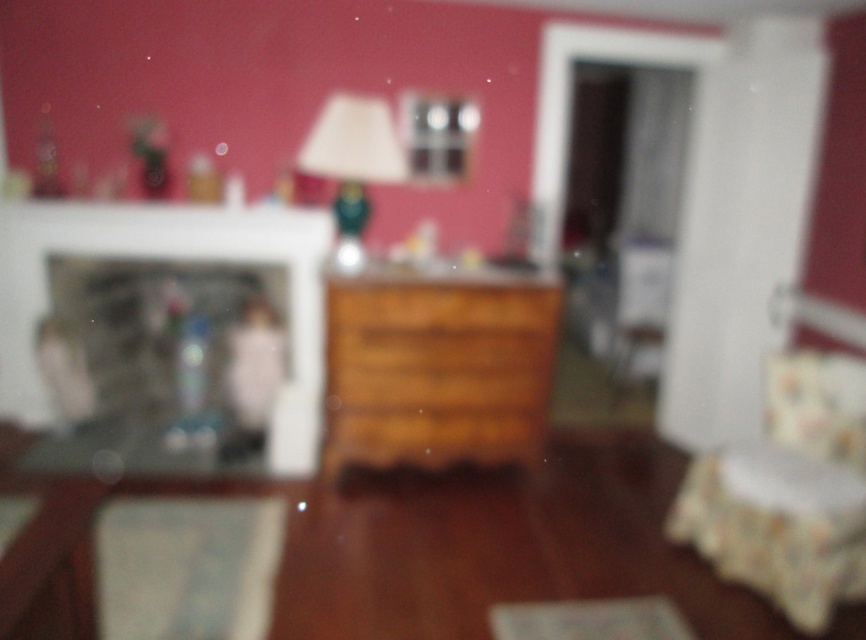
Is white glossy fireplace at center to the right of wooden drawer at center from the viewer's perspective?

Incorrect, white glossy fireplace at center is not on the right side of wooden drawer at center.

In the scene shown: Which is more to the right, white glossy fireplace at center or wooden drawer at center?

wooden drawer at center

Looking at this image, measure the distance between point (307, 252) and camera.

Point (307, 252) and camera are 3.62 meters apart.

At what (x,y) coordinates should I click in order to perform the action: click on white glossy fireplace at center. Please return your answer as a coordinate pair (x, y). Looking at the image, I should click on (167, 259).

Can you confirm if white glossy fireplace at center is positioned below matte green lamp at center?

Yes.

Which is in front, point (282, 465) or point (376, 164)?

Point (376, 164)

Which is in front, point (281, 424) or point (347, 161)?

Point (347, 161) is more forward.

Image resolution: width=866 pixels, height=640 pixels. In order to click on white glossy fireplace at center in this screenshot , I will do `click(167, 259)`.

Does wooden dresser at center have a lesser width compared to wooden drawer at center?

In fact, wooden dresser at center might be wider than wooden drawer at center.

This screenshot has width=866, height=640. Identify the location of wooden dresser at center. (437, 368).